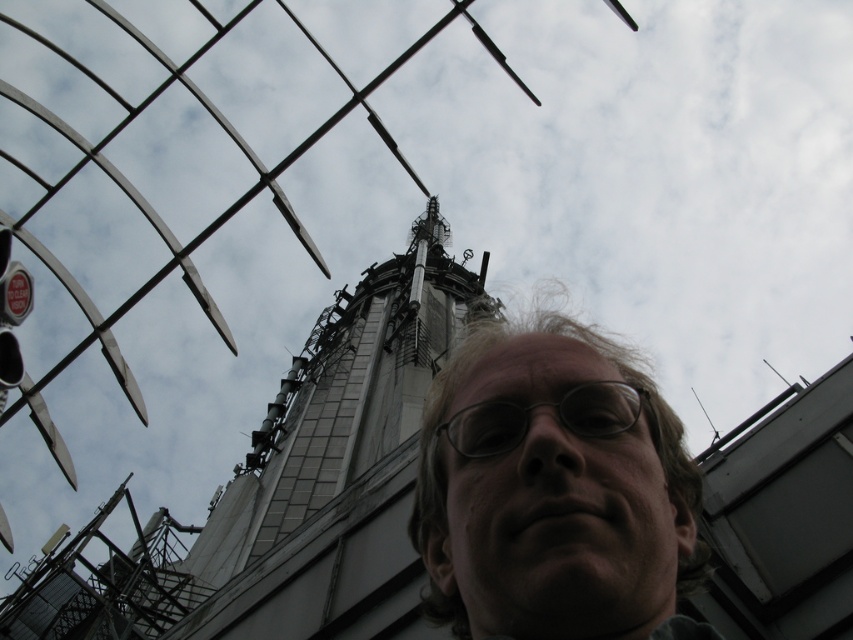
Question: Is silver metallic tower at center above clear plastic glasses at center?

Choices:
 (A) no
 (B) yes

Answer: (B)

Question: Which point is farther to the camera?

Choices:
 (A) (318, 429)
 (B) (473, 454)

Answer: (A)

Question: Is silver metallic tower at center closer to the viewer compared to clear plastic glasses at center?

Choices:
 (A) yes
 (B) no

Answer: (B)

Question: Among these objects, which one is nearest to the camera?

Choices:
 (A) light brown hair at center
 (B) clear plastic glasses at center

Answer: (A)

Question: Considering the relative positions of silver metallic tower at center and clear plastic glasses at center in the image provided, where is silver metallic tower at center located with respect to clear plastic glasses at center?

Choices:
 (A) left
 (B) right

Answer: (A)

Question: Which of the following is the farthest from the observer?

Choices:
 (A) clear plastic glasses at center
 (B) light brown hair at center

Answer: (A)